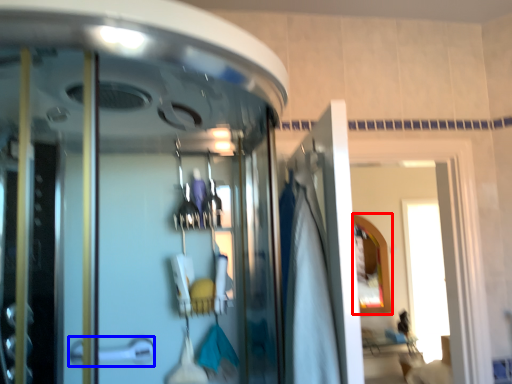
Question: Among these objects, which one is farthest to the camera, mirror (highlighted by a red box) or door handle (highlighted by a blue box)?

Choices:
 (A) mirror
 (B) door handle

Answer: (A)